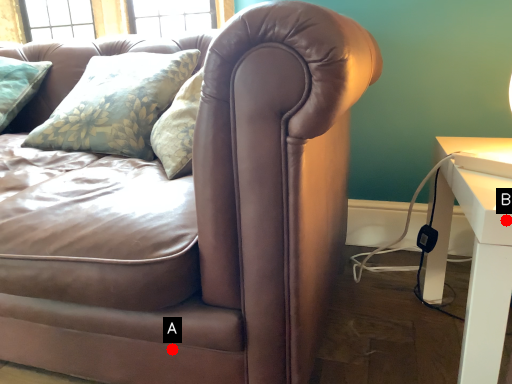
Question: Two points are circled on the image, labeled by A and B beside each circle. Which point is closer to the camera taking this photo?

Choices:
 (A) A is closer
 (B) B is closer

Answer: (B)